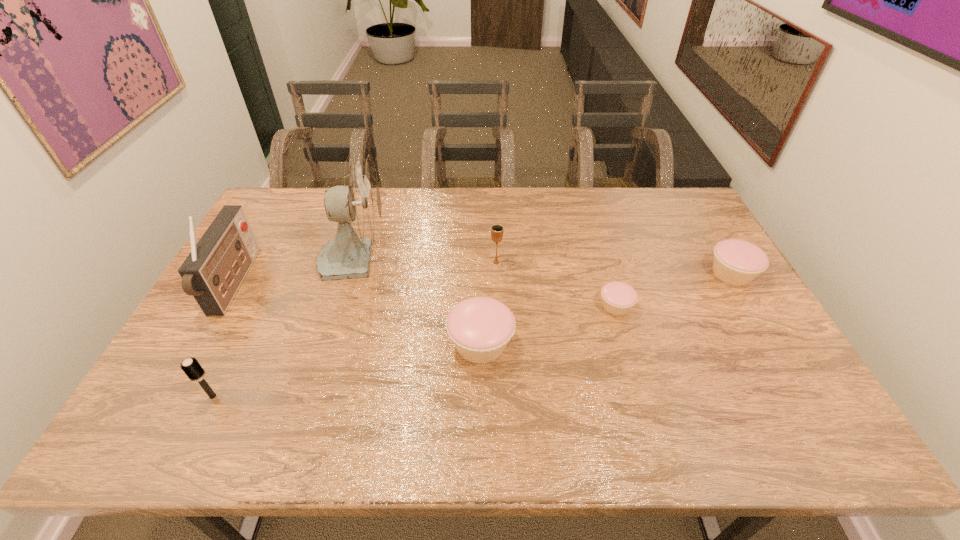
Locate which cupcake is the second closest to the chalice. Please provide its 2D coordinates. Your answer should be formatted as a tuple, i.e. [(x, y)], where the tuple contains the x and y coordinates of a point satisfying the conditions above.

[(618, 298)]

Find the location of a particular element. vacant space that satisfies the following two spatial constraints: 1. in front of the sixth object from left to right to blow air; 2. on the right side of the tallest object is located at coordinates [x=341, y=306].

Locate an element on the screen. The width and height of the screenshot is (960, 540). free location that satisfies the following two spatial constraints: 1. on the back side of the leftmost cupcake; 2. on the right side of the chalice is located at coordinates (481, 262).

I want to click on free space that satisfies the following two spatial constraints: 1. on the back side of the second object from right to left; 2. on the right side of the nearest object, so click(257, 306).

Locate an element on the screen. The image size is (960, 540). vacant space that satisfies the following two spatial constraints: 1. in front of the leftmost cupcake to blow air; 2. on the left side of the third object from left to right is located at coordinates (329, 344).

Locate an element on the screen. The height and width of the screenshot is (540, 960). vacant space that satisfies the following two spatial constraints: 1. on the back side of the leftmost cupcake; 2. on the right side of the rightmost cupcake is located at coordinates (481, 274).

This screenshot has width=960, height=540. I want to click on free spot that satisfies the following two spatial constraints: 1. on the back side of the chalice; 2. on the right side of the leftmost cupcake, so click(481, 262).

I want to click on vacant space that satisfies the following two spatial constraints: 1. on the front side of the chalice; 2. on the front panel of the leftmost object, so click(x=497, y=284).